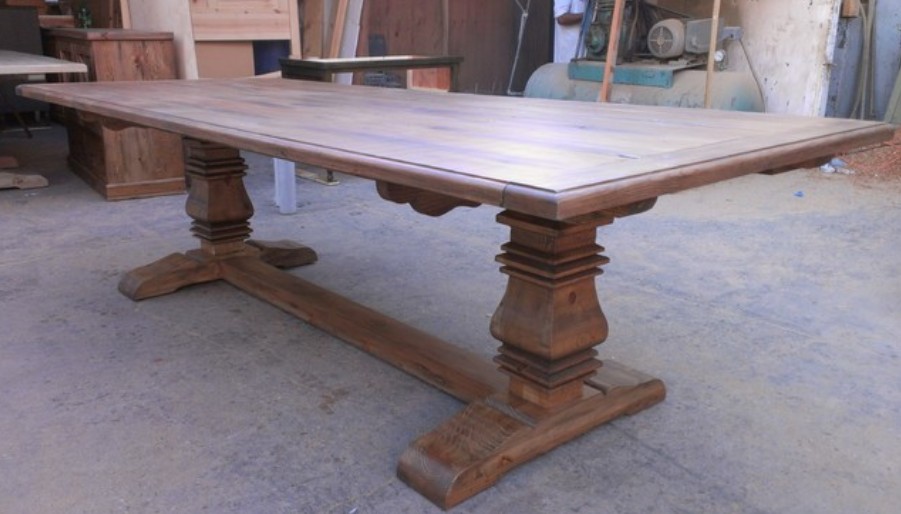
Find the location of a particular element. The width and height of the screenshot is (901, 514). table leg is located at coordinates (560, 296), (214, 198).